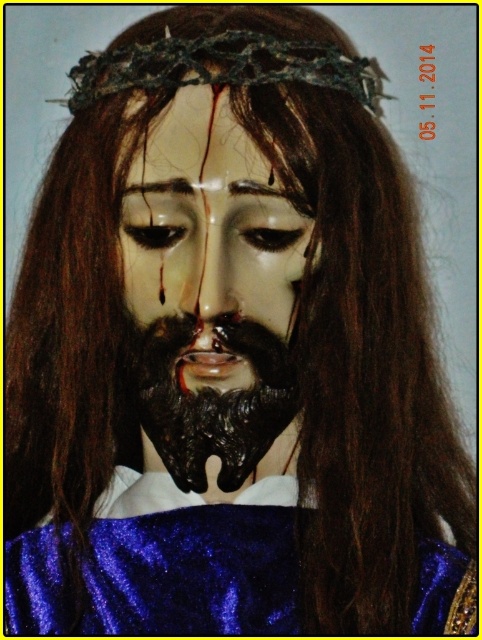
Question: Among these points, which one is nearest to the camera?

Choices:
 (A) [x=298, y=81]
 (B) [x=131, y=545]
 (C) [x=174, y=451]
 (D) [x=171, y=154]

Answer: (D)

Question: Which point is farther to the camera?

Choices:
 (A) glossy wax forehead at center
 (B) dark green spiky crown at upper center
 (C) porcelain face at center
 (D) blue glittery robe at center

Answer: (D)

Question: Is porcelain face at center wider than dark green spiky crown at upper center?

Choices:
 (A) yes
 (B) no

Answer: (B)

Question: Which of the following is the closest to the observer?

Choices:
 (A) 164,163
 (B) 152,580
 (C) 264,435
 (D) 71,100

Answer: (A)

Question: Does blue glittery robe at center have a larger size compared to black matte beard at center?

Choices:
 (A) no
 (B) yes

Answer: (B)

Question: Considering the relative positions of porcelain face at center and black matte beard at center in the image provided, where is porcelain face at center located with respect to black matte beard at center?

Choices:
 (A) above
 (B) below

Answer: (A)